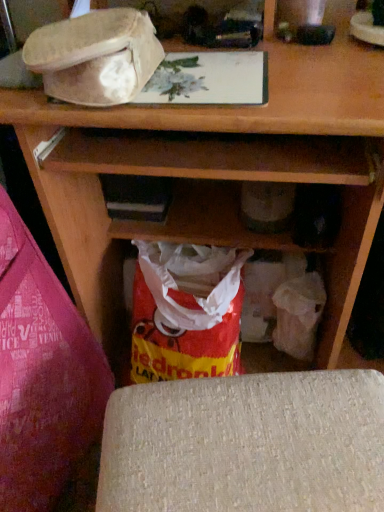
This screenshot has width=384, height=512. What do you see at coordinates (246, 444) in the screenshot? I see `textured beige cushion at lower center` at bounding box center [246, 444].

Measure the distance between red plastic grocery bag at lower center and camera.

The distance of red plastic grocery bag at lower center from camera is 33.14 inches.

Where is `textured beige cushion at lower center`? The image size is (384, 512). textured beige cushion at lower center is located at coordinates (246, 444).

How many degrees apart are the facing directions of textured beige cushion at lower center and red plastic grocery bag at lower center?

textured beige cushion at lower center and red plastic grocery bag at lower center are facing 8.17 degrees away from each other.

Where is `grocery bag located on the left of textured beige cushion at lower center`? grocery bag located on the left of textured beige cushion at lower center is located at coordinates tap(186, 312).

From a real-world perspective, is textured beige cushion at lower center located higher than red plastic grocery bag at lower center?

Indeed, from a real-world perspective, textured beige cushion at lower center stands above red plastic grocery bag at lower center.

Can you confirm if textured beige cushion at lower center is shorter than red plastic grocery bag at lower center?

No, textured beige cushion at lower center is not shorter than red plastic grocery bag at lower center.

From the image's perspective, is fuzzy beige hat at upper left located above red plastic grocery bag at lower center?

Yes.

Which of these two, fuzzy beige hat at upper left or red plastic grocery bag at lower center, is bigger?

Bigger between the two is red plastic grocery bag at lower center.

Can you tell me how much fuzzy beige hat at upper left and red plastic grocery bag at lower center differ in facing direction?

The angular difference between fuzzy beige hat at upper left and red plastic grocery bag at lower center is 2.52 degrees.

Between fuzzy beige hat at upper left and red plastic grocery bag at lower center, which one has smaller width?

fuzzy beige hat at upper left.

Between textured beige cushion at lower center and red plastic bag at lower left, which one appears on the right side from the viewer's perspective?

textured beige cushion at lower center.

Is textured beige cushion at lower center positioned far away from red plastic bag at lower left?

No.

Is point (116, 405) less distant than point (12, 293)?

That is True.

Is textured beige cushion at lower center taller than red plastic bag at lower left?

No, textured beige cushion at lower center is not taller than red plastic bag at lower left.

Considering the sizes of objects textured beige cushion at lower center and fuzzy beige hat at upper left in the image provided, who is wider, textured beige cushion at lower center or fuzzy beige hat at upper left?

fuzzy beige hat at upper left is wider.

From the image's perspective, is textured beige cushion at lower center over fuzzy beige hat at upper left?

No.

Is textured beige cushion at lower center turned away from fuzzy beige hat at upper left?

That's not correct — textured beige cushion at lower center is not looking away from fuzzy beige hat at upper left.

Between textured beige cushion at lower center and fuzzy beige hat at upper left, which one is positioned behind?

fuzzy beige hat at upper left is more distant.

Does point (165, 301) come behind point (136, 489)?

Yes.

From a real-world perspective, is red plastic grocery bag at lower center above or below textured beige cushion at lower center?

Clearly, from a real-world perspective, red plastic grocery bag at lower center is below textured beige cushion at lower center.

Can you confirm if red plastic grocery bag at lower center is positioned to the left of textured beige cushion at lower center?

Yes, red plastic grocery bag at lower center is to the left of textured beige cushion at lower center.

Considering the sizes of red plastic grocery bag at lower center and textured beige cushion at lower center in the image, is red plastic grocery bag at lower center bigger or smaller than textured beige cushion at lower center?

red plastic grocery bag at lower center is bigger than textured beige cushion at lower center.

In the scene shown: Is red plastic grocery bag at lower center positioned with its back to red plastic bag at lower left?

No.

Based on the photo, is red plastic grocery bag at lower center shorter than red plastic bag at lower left?

Answer: Indeed, red plastic grocery bag at lower center has a lesser height compared to red plastic bag at lower left.

Is fuzzy beige hat at upper left a part of red plastic grocery bag at lower center?

No, red plastic grocery bag at lower center does not contain fuzzy beige hat at upper left.

Which is closer, (224, 364) or (154, 52)?

Point (224, 364) is farther from the camera than point (154, 52).

Can you confirm if red plastic grocery bag at lower center is shorter than fuzzy beige hat at upper left?

In fact, red plastic grocery bag at lower center may be taller than fuzzy beige hat at upper left.

From a real-world perspective, is red plastic grocery bag at lower center on fuzzy beige hat at upper left?

No, from a real-world perspective, red plastic grocery bag at lower center is not on top of fuzzy beige hat at upper left.

You are a GUI agent. You are given a task and a screenshot of the screen. Output one action in this format:
    pyautogui.click(x=<x>, y=<y>)
    Task: Click on the grocery bag above the textured beige cushion at lower center (from the image's perspective)
    This screenshot has height=512, width=384.
    Given the screenshot: What is the action you would take?
    tap(186, 312)

Locate an element on the screen. The width and height of the screenshot is (384, 512). grocery bag below the fuzzy beige hat at upper left (from a real-world perspective) is located at coordinates (186, 312).

In the scene shown: Estimate the real-world distances between objects in this image. Which object is closer to textured beige cushion at lower center, fuzzy beige hat at upper left or red plastic bag at lower left?

red plastic bag at lower left is positioned closer to the anchor textured beige cushion at lower center.

Looking at the image, which one is located closer to fuzzy beige hat at upper left, red plastic grocery bag at lower center or red plastic bag at lower left?

Among the two, red plastic bag at lower left is located nearer to fuzzy beige hat at upper left.

Based on the photo, looking at the image, which one is located closer to fuzzy beige hat at upper left, red plastic bag at lower left or red plastic grocery bag at lower center?

red plastic bag at lower left lies closer to fuzzy beige hat at upper left than the other object.

Considering their positions, is red plastic bag at lower left positioned closer to fuzzy beige hat at upper left than textured beige cushion at lower center?

red plastic bag at lower left lies closer to fuzzy beige hat at upper left than the other object.

Based on their spatial positions, is fuzzy beige hat at upper left or red plastic grocery bag at lower center further from textured beige cushion at lower center?

Based on the image, fuzzy beige hat at upper left appears to be further to textured beige cushion at lower center.

From the image, which object appears to be nearer to red plastic grocery bag at lower center, textured beige cushion at lower center or red plastic bag at lower left?

Among the two, red plastic bag at lower left is located nearer to red plastic grocery bag at lower center.

From the image, which object appears to be nearer to fuzzy beige hat at upper left, textured beige cushion at lower center or red plastic bag at lower left?

Among the two, red plastic bag at lower left is located nearer to fuzzy beige hat at upper left.

Considering their positions, is red plastic bag at lower left positioned closer to red plastic grocery bag at lower center than textured beige cushion at lower center?

Based on the image, red plastic bag at lower left appears to be nearer to red plastic grocery bag at lower center.

Locate an element on the screen. grocery bag located between red plastic bag at lower left and textured beige cushion at lower center in the left-right direction is located at coordinates (186, 312).

The width and height of the screenshot is (384, 512). Find the location of `grocery bag between fuzzy beige hat at upper left and textured beige cushion at lower center from top to bottom`. grocery bag between fuzzy beige hat at upper left and textured beige cushion at lower center from top to bottom is located at coordinates (186, 312).

At what (x,y) coordinates should I click in order to perform the action: click on leftover between fuzzy beige hat at upper left and textured beige cushion at lower center in the vertical direction. Please return your answer as a coordinate pair (x, y). Looking at the image, I should click on (42, 374).

This screenshot has height=512, width=384. I want to click on grocery bag between fuzzy beige hat at upper left and red plastic bag at lower left from top to bottom, so click(x=186, y=312).